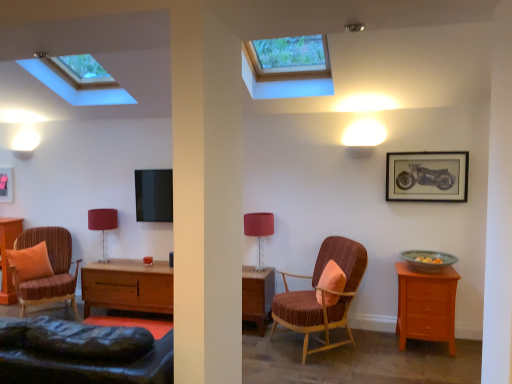
Question: Considering the positions of velvet-like brown armchair at center, which appears as the first chair when viewed from the right, and matte black picture frame at upper right, which is the 1th picture frame from right to left, in the image, is velvet-like brown armchair at center, which appears as the first chair when viewed from the right, bigger or smaller than matte black picture frame at upper right, which is the 1th picture frame from right to left,?

Choices:
 (A) small
 (B) big

Answer: (B)

Question: Would you say velvet-like brown armchair at center, which appears as the first chair when viewed from the right, is to the left or to the right of matte black picture frame at upper right, marked as the second picture frame in a left-to-right arrangement, in the picture?

Choices:
 (A) right
 (B) left

Answer: (B)

Question: Estimate the real-world distances between objects in this image. Which object is farther from the matte black picture frame at upper left, the first picture frame from the left?

Choices:
 (A) wooden nightstand at left
 (B) matte orange cushion at left, which is counted as the 2th pillow, starting from the front
 (C) matte brown armchair at left, the 1th chair in the left-to-right sequence
 (D) velvet-like brown armchair at center, the second chair in the left-to-right sequence
 (E) matte black picture frame at upper right, the second picture frame positioned from the back

Answer: (E)

Question: Based on their relative distances, which object is farther from the matte black picture frame at upper right, the second picture frame positioned from the back?

Choices:
 (A) matte red lampshade at center, which is the second table lamp from right to left
 (B) matte orange cushion at left, which is counted as the 2th pillow, starting from the front
 (C) velvet-like brown armchair at center, the second chair in the left-to-right sequence
 (D) orange fabric pillow at center, which is the first pillow in front-to-back order
 (E) wooden nightstand at left

Answer: (E)